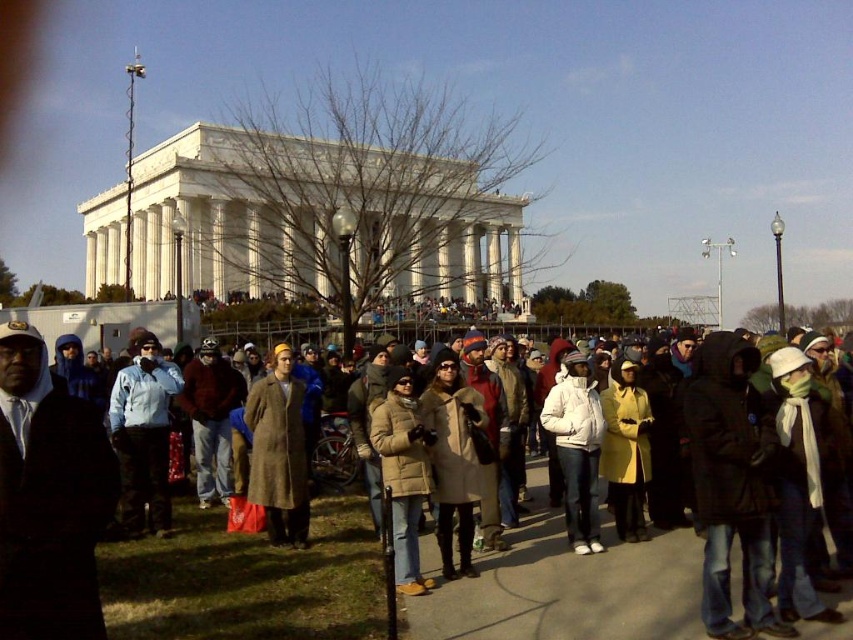
Which is more to the left, light brown coat at center or brown wool coat at center?

brown wool coat at center

Where is `light brown coat at center`? The width and height of the screenshot is (853, 640). light brown coat at center is located at coordinates (567, 588).

Between light brown coat at center and white matte jacket at center, which one is positioned higher?

white matte jacket at center

Does light brown coat at center come behind white matte jacket at center?

No, it is in front of white matte jacket at center.

Does point (624, 563) come in front of point (587, 406)?

Yes, point (624, 563) is in front of point (587, 406).

Find the location of `light brown coat at center`. light brown coat at center is located at coordinates (567, 588).

Which of these two, brown wool coat at center or white matte jacket at center, stands shorter?

white matte jacket at center

Is point (270, 496) positioned in front of point (599, 429)?

Yes, point (270, 496) is in front of point (599, 429).

Between point (244, 419) and point (573, 545), which one is positioned behind?

Point (244, 419)

Locate an element on the screen. Image resolution: width=853 pixels, height=640 pixels. brown wool coat at center is located at coordinates (277, 451).